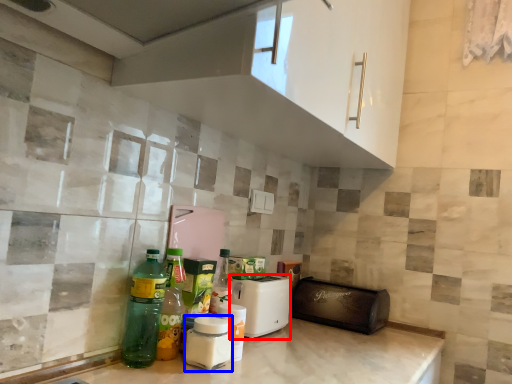
Question: Which object appears closest to the camera in this image, appliance (highlighted by a red box) or bottle (highlighted by a blue box)?

Choices:
 (A) appliance
 (B) bottle

Answer: (B)